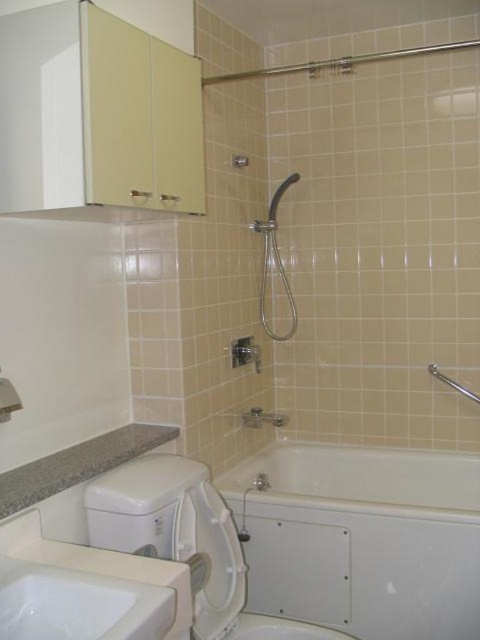
Question: Which object is the closest to the matte silver shower head at center?

Choices:
 (A) white glossy bathtub at lower center
 (B) granite countertop at lower left
 (C) white ceramic sink at lower left
 (D) matte silver faucet at lower center

Answer: (D)

Question: Is matte silver shower head at center closer to the viewer compared to matte silver faucet at lower center?

Choices:
 (A) no
 (B) yes

Answer: (A)

Question: Can you confirm if white ceramic sink at lower left is positioned above matte silver shower head at center?

Choices:
 (A) yes
 (B) no

Answer: (B)

Question: Estimate the real-world distances between objects in this image. Which object is farther from the matte silver faucet at lower center?

Choices:
 (A) white glossy bathtub at lower center
 (B) matte silver shower head at center
 (C) granite countertop at lower left

Answer: (C)

Question: Does white glossy bathtub at lower center have a greater width compared to white ceramic sink at lower left?

Choices:
 (A) no
 (B) yes

Answer: (B)

Question: Which object is closer to the camera taking this photo?

Choices:
 (A) matte silver shower head at center
 (B) granite countertop at lower left
 (C) white ceramic sink at lower left

Answer: (C)